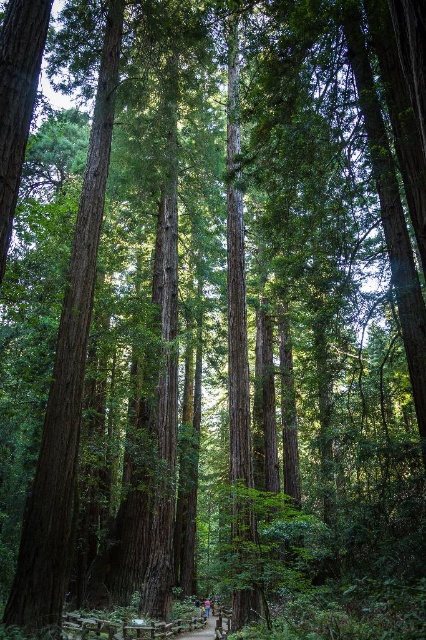
Who is higher up, brown wooden path at center or blue denim jeans at center?

Positioned higher is brown wooden path at center.

Is brown wooden path at center taller than blue denim jeans at center?

Indeed, brown wooden path at center has a greater height compared to blue denim jeans at center.

You are a GUI agent. You are given a task and a screenshot of the screen. Output one action in this format:
    pyautogui.click(x=<x>, y=<y>)
    Task: Click on the brown wooden path at center
    The height and width of the screenshot is (640, 426).
    Given the screenshot: What is the action you would take?
    pyautogui.click(x=209, y=627)

Where is `brown wooden path at center`? This screenshot has height=640, width=426. brown wooden path at center is located at coordinates (209, 627).